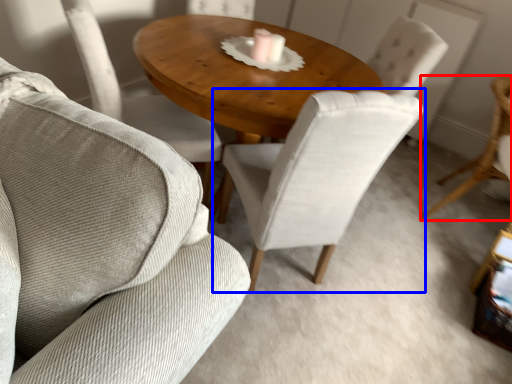
Question: Which object appears farthest to the camera in this image, chair (highlighted by a red box) or chair (highlighted by a blue box)?

Choices:
 (A) chair
 (B) chair

Answer: (A)